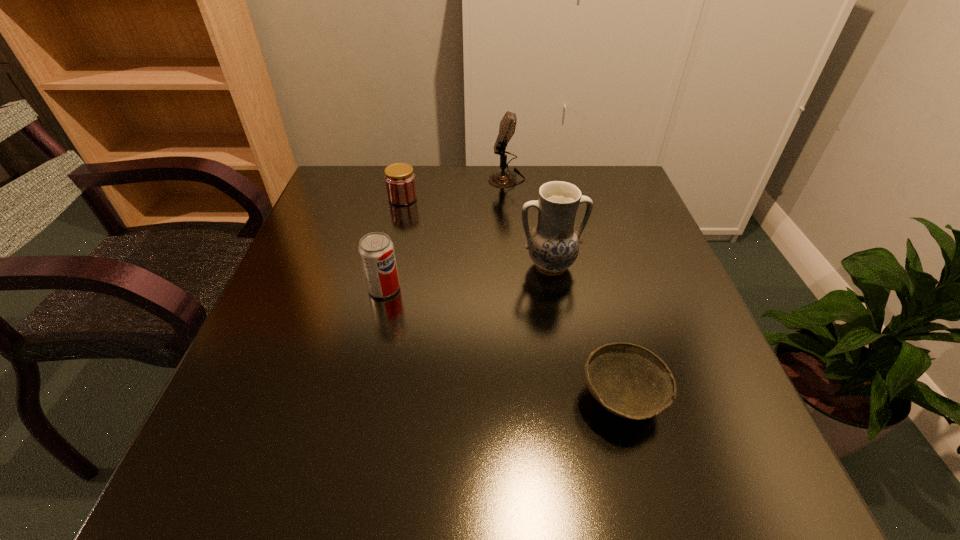
Where is `microphone`? Image resolution: width=960 pixels, height=540 pixels. microphone is located at coordinates (502, 179).

The width and height of the screenshot is (960, 540). What are the coordinates of `pottery` in the screenshot? It's located at (553, 245).

This screenshot has width=960, height=540. What are the coordinates of `the third shortest object` in the screenshot? It's located at (376, 250).

This screenshot has height=540, width=960. What are the coordinates of `the fourth tallest object` in the screenshot? It's located at (400, 183).

This screenshot has width=960, height=540. I want to click on the second farthest object, so click(x=400, y=183).

Where is `the nearest object`? This screenshot has height=540, width=960. the nearest object is located at coordinates (630, 381).

Find the location of a particular element. Image resolution: width=960 pixels, height=540 pixels. the shortest object is located at coordinates (630, 381).

This screenshot has width=960, height=540. In order to click on vacant space located on the front-facing side of the microphone in this screenshot , I will do `click(361, 178)`.

Image resolution: width=960 pixels, height=540 pixels. I want to click on vacant space located 0.230m on the front-facing side of the microphone, so click(x=407, y=178).

Locate an element on the screen. The image size is (960, 540). blank area located on the front-facing side of the microphone is located at coordinates (453, 178).